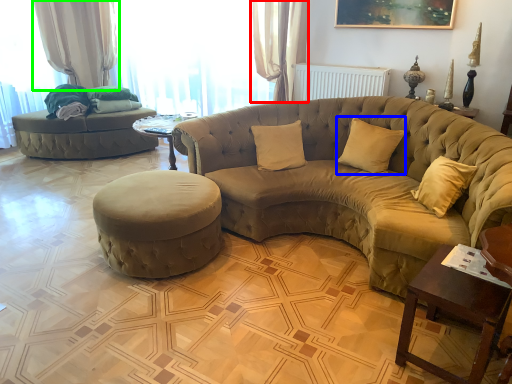
Question: Which is farther away from curtain (highlighted by a red box)? pillow (highlighted by a blue box) or curtain (highlighted by a green box)?

Choices:
 (A) pillow
 (B) curtain

Answer: (B)